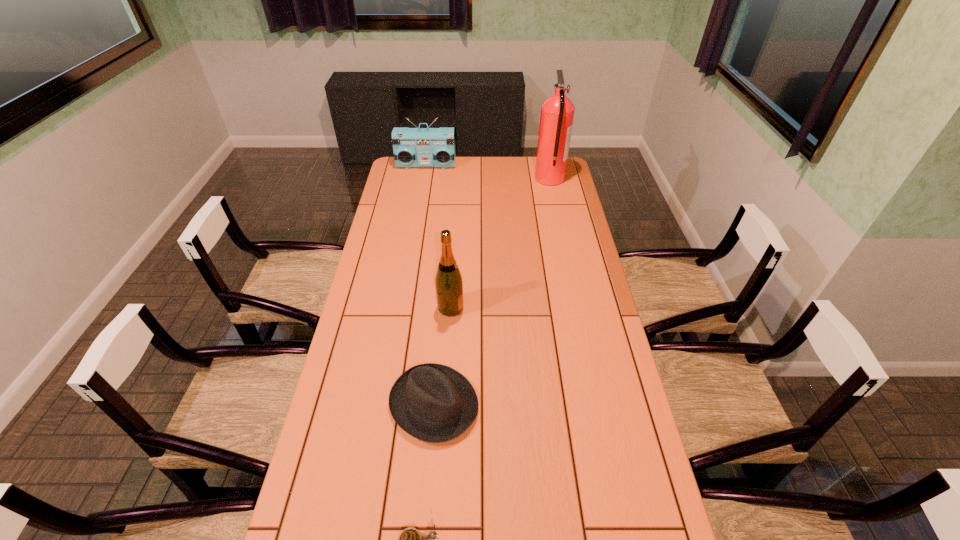
What are the coordinates of `free spot located on the front-facing side of the third shortest object` in the screenshot? It's located at (420, 203).

I want to click on vacant space located on the right of the fedora, so (502, 404).

The height and width of the screenshot is (540, 960). I want to click on fire extinguisher at the far edge, so click(557, 112).

At what (x,y) coordinates should I click in order to perform the action: click on radio receiver situated at the far edge. Please return your answer as a coordinate pair (x, y). This screenshot has height=540, width=960. Looking at the image, I should click on (x=413, y=147).

The image size is (960, 540). What are the coordinates of `object located at the left edge` in the screenshot? It's located at (413, 147).

Where is `object that is at the right edge`? The image size is (960, 540). object that is at the right edge is located at coordinates (557, 112).

Find the location of `object present at the far left corner`. object present at the far left corner is located at coordinates (413, 147).

You are a GUI agent. You are given a task and a screenshot of the screen. Output one action in this format:
    pyautogui.click(x=<x>, y=<y>)
    Task: Click on the object positioned at the far right corner
    The width and height of the screenshot is (960, 540).
    Given the screenshot: What is the action you would take?
    [557, 112]

The height and width of the screenshot is (540, 960). I want to click on vacant space at the far edge, so click(x=532, y=163).

Locate an element on the screen. The image size is (960, 540). vacant region at the left edge of the desktop is located at coordinates (358, 305).